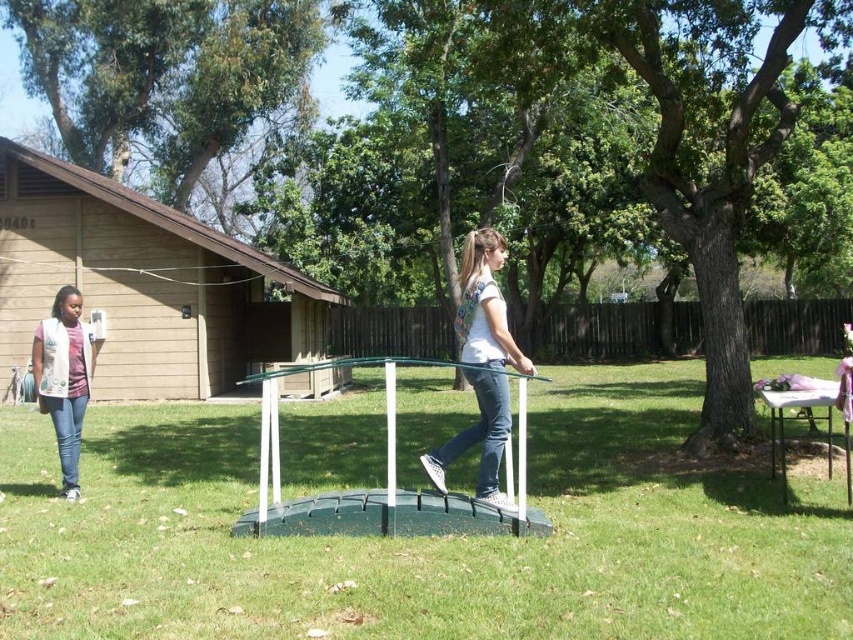
Question: Which of the following is the farthest from the observer?

Choices:
 (A) 492,435
 (B) 61,378
 (C) 140,413

Answer: (C)

Question: Among these objects, which one is nearest to the camera?

Choices:
 (A) green plastic trampoline at center
 (B) white matte shirt at center
 (C) denim jeans at left

Answer: (A)

Question: Observing the image, what is the correct spatial positioning of white matte shirt at center in reference to denim jeans at left?

Choices:
 (A) above
 (B) below

Answer: (A)

Question: Can you confirm if green plastic trampoline at center is thinner than denim jeans at left?

Choices:
 (A) no
 (B) yes

Answer: (A)

Question: Which of the following is the closest to the observer?

Choices:
 (A) (642, 429)
 (B) (494, 404)

Answer: (B)

Question: Where is white matte shirt at center located in relation to denim jeans at left in the image?

Choices:
 (A) left
 (B) right

Answer: (B)